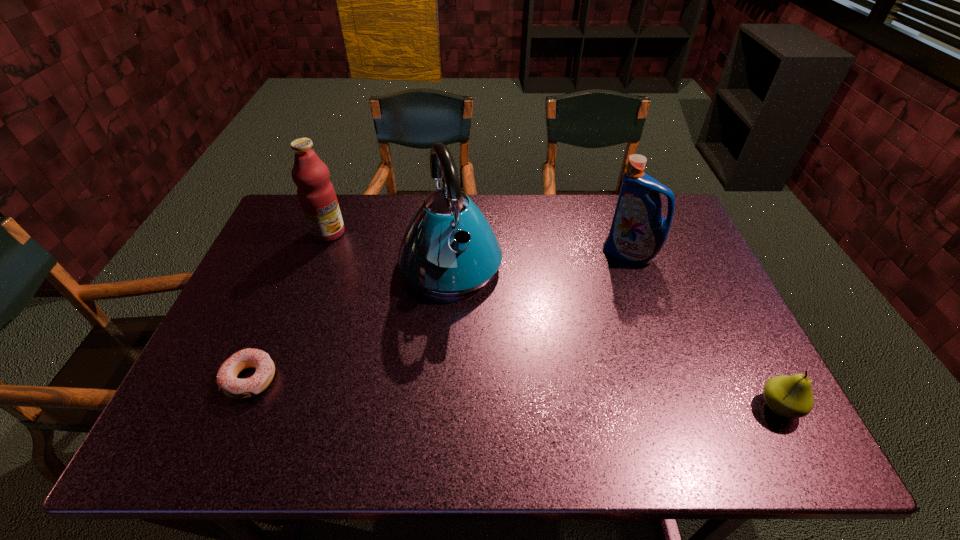
The width and height of the screenshot is (960, 540). What are the coordinates of `pear located at the near edge` in the screenshot? It's located at (791, 397).

You are a GUI agent. You are given a task and a screenshot of the screen. Output one action in this format:
    pyautogui.click(x=<x>, y=<y>)
    Task: Click on the doughnut at the left edge
    
    Given the screenshot: What is the action you would take?
    pyautogui.click(x=227, y=381)

Find the location of a particular element. This screenshot has height=540, width=960. fruit juice present at the left edge is located at coordinates (316, 194).

Image resolution: width=960 pixels, height=540 pixels. I want to click on pear that is at the right edge, so click(791, 397).

Identify the location of detergent at the right edge. Image resolution: width=960 pixels, height=540 pixels. (638, 232).

Where is `object that is at the far left corner`? object that is at the far left corner is located at coordinates (316, 194).

The image size is (960, 540). Find the location of `object present at the near left corner`. object present at the near left corner is located at coordinates (227, 381).

Identify the location of object present at the near right corner. This screenshot has height=540, width=960. (791, 397).

This screenshot has width=960, height=540. Find the location of `vacant region at the far edge of the desktop`. vacant region at the far edge of the desktop is located at coordinates (601, 224).

Locate an element on the screen. vacant space at the near edge of the desktop is located at coordinates (564, 406).